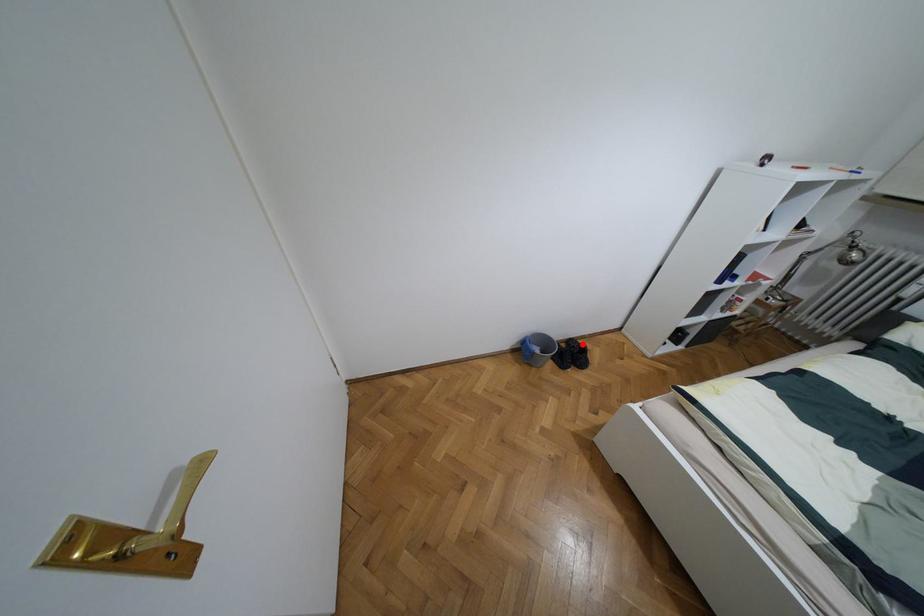
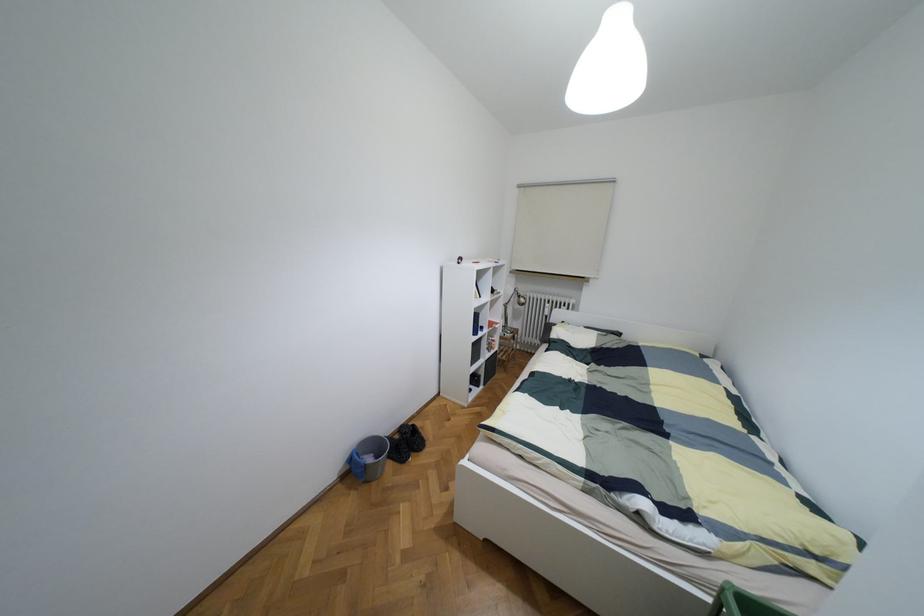
Locate, in the second image, the point that corresponds to the highlighted location in the first image.

(412, 424)